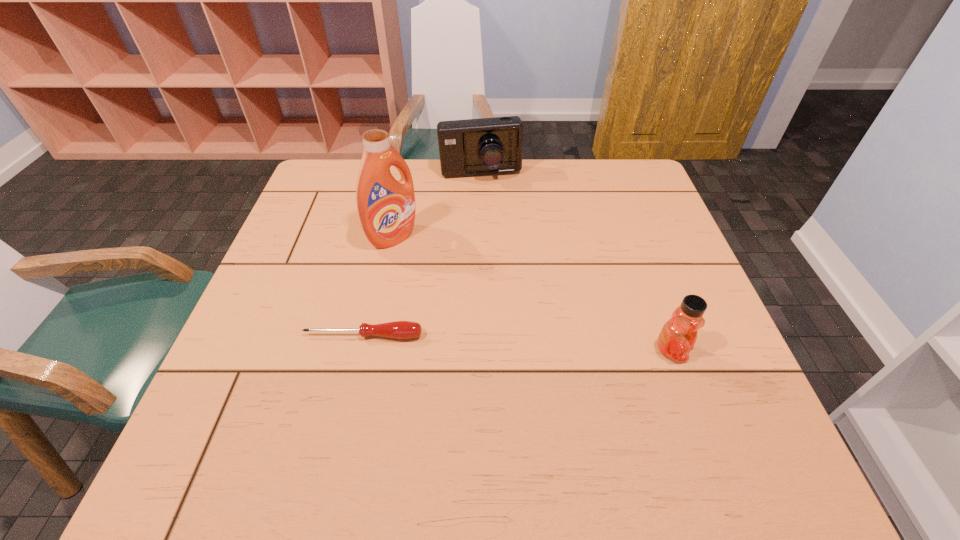
This screenshot has height=540, width=960. Find the location of `free space on the desktop that is between the shortest object and the honey and is positioned on the front-facing side of the third nearest object`. free space on the desktop that is between the shortest object and the honey and is positioned on the front-facing side of the third nearest object is located at coordinates (551, 345).

Image resolution: width=960 pixels, height=540 pixels. I want to click on free spot on the desktop that is between the shortest object and the rightmost object and is positioned on the front-facing side of the farthest object, so tap(503, 342).